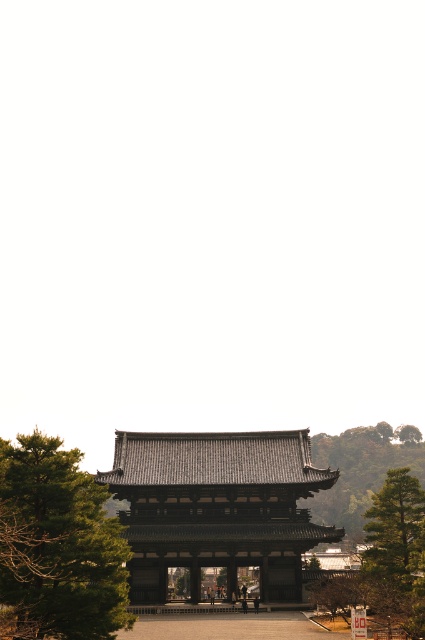
You are standing at the entrance of the temple and notice a point marked at coordinates (57, 545). Which object does this point correspond to?

The point marked at coordinates (57, 545) corresponds to the green leafy tree at left.

You are a visitor approaching the dark gray tiled gate at center and notice the green leafy tree at left nearby. Which object appears bigger in the image?

The dark gray tiled gate at center appears bigger than the green leafy tree at left in the image.

You are standing in front of the dark gray tiled gate at center and want to walk towards the green leafy tree at left. Which direction should you go to move closer to the tree?

You should walk towards the green leafy tree at left, which is located to your left side. Since the dark gray tiled gate at center is closer to you than the tree, you need to move sideways towards the left to approach the tree.